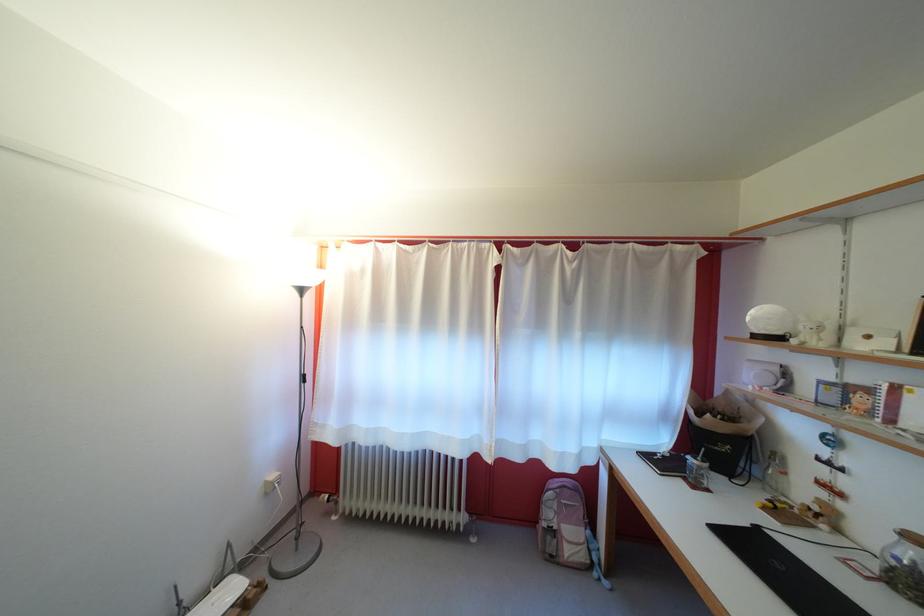
The height and width of the screenshot is (616, 924). I want to click on glass bottle, so click(904, 565).